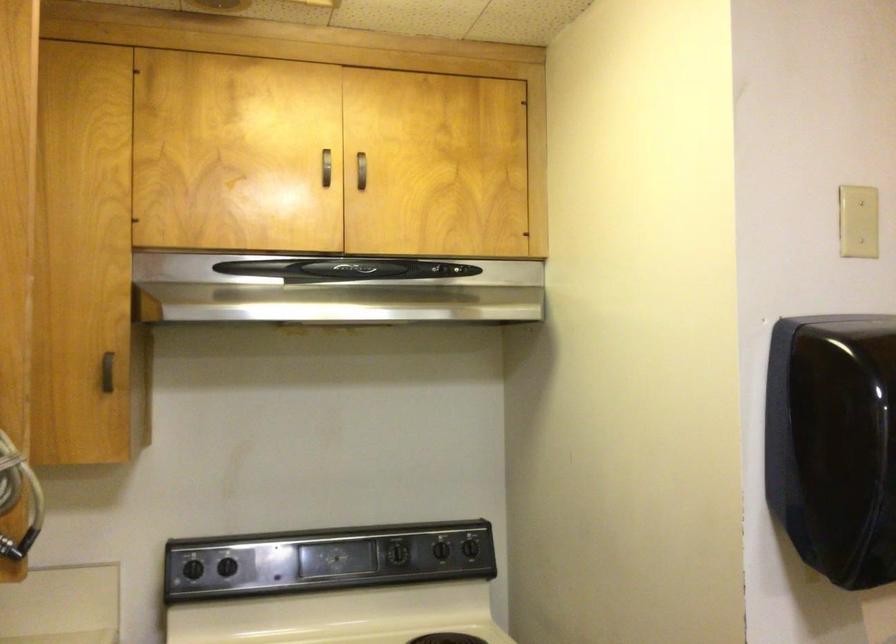
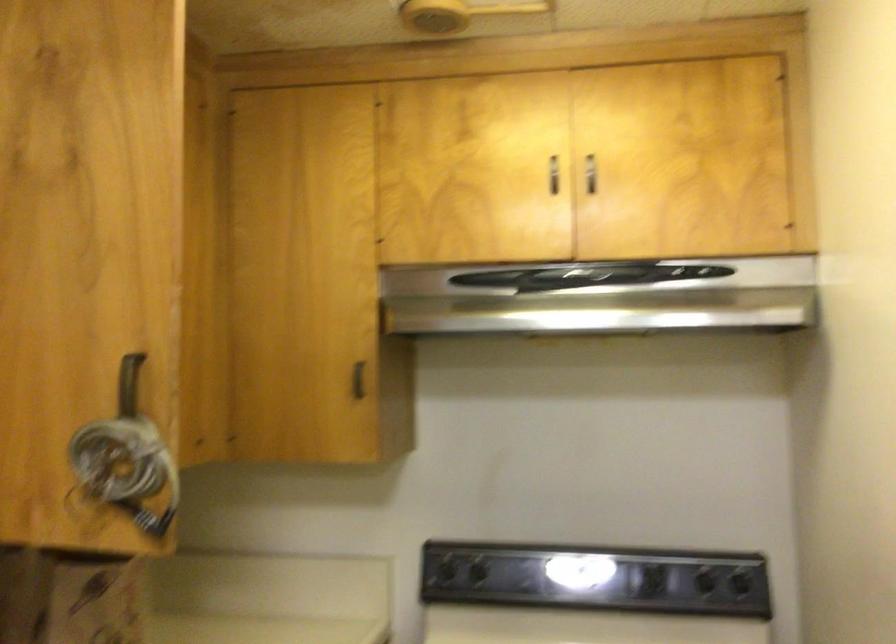
The images are taken continuously from a first-person perspective. In which direction are you moving?

The cameraman walked toward right, forward.